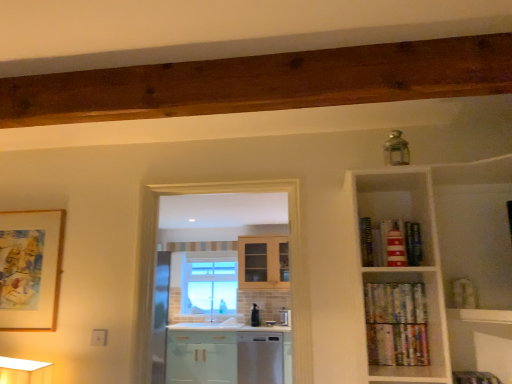
Identify the location of blank space situated above hardcover books at right, the second book positioned from the top (from a real-world perspective). (388, 283).